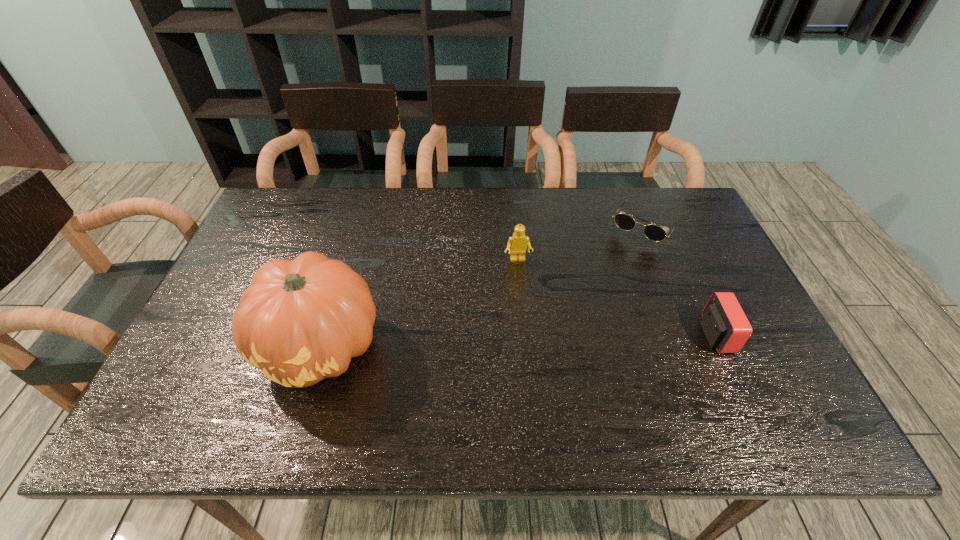
Identify the location of vacant space situated on the front lenses of the sunglasses. This screenshot has width=960, height=540. (611, 278).

You are a GUI agent. You are given a task and a screenshot of the screen. Output one action in this format:
    pyautogui.click(x=<x>, y=<y>)
    Task: Click on the vacant region located 0.230m on the front lenses of the sunglasses
    
    Given the screenshot: What is the action you would take?
    pyautogui.click(x=599, y=295)

Where is `vacant space located on the front lenses of the sunglasses`? vacant space located on the front lenses of the sunglasses is located at coordinates (623, 259).

Find the location of a particular element. This screenshot has width=960, height=540. object at the far edge is located at coordinates (655, 233).

The height and width of the screenshot is (540, 960). I want to click on object situated at the near edge, so click(301, 321).

The height and width of the screenshot is (540, 960). I want to click on alarm clock that is at the right edge, so click(x=726, y=327).

This screenshot has height=540, width=960. What are the coordinates of `sunglasses at the right edge` in the screenshot? It's located at (655, 233).

Where is `object present at the far right corner`? This screenshot has width=960, height=540. object present at the far right corner is located at coordinates (655, 233).

Identify the location of vacant space at the far edge. (397, 202).

Identify the location of free space at the near edge of the desktop. This screenshot has height=540, width=960. (544, 389).